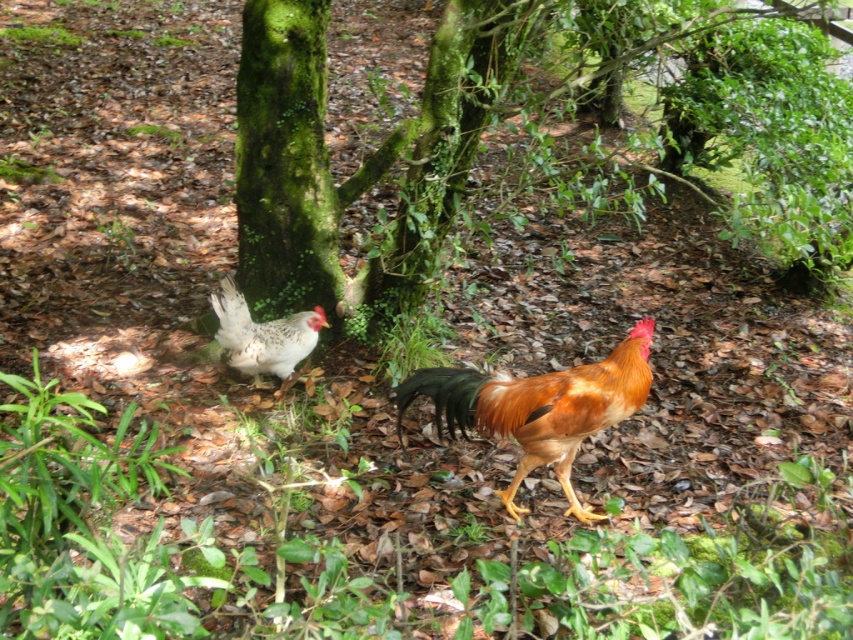
Which of these two, green mossy tree at center or speckled feathered chicken at center, stands taller?

With more height is green mossy tree at center.

Does green mossy tree at center have a smaller size compared to speckled feathered chicken at center?

Incorrect, green mossy tree at center is not smaller in size than speckled feathered chicken at center.

Measure the distance between green mossy tree at center and camera.

The distance of green mossy tree at center from camera is 3.05 meters.

Locate an element on the screen. This screenshot has width=853, height=640. green mossy tree at center is located at coordinates pos(505,113).

Is point (630, 390) positioned before point (233, 317)?

Yes, point (630, 390) is in front of point (233, 317).

Is golden brown feathered rooster at center above speckled feathered chicken at center?

No.

Who is more distant from viewer, (476, 381) or (270, 330)?

The point (270, 330) is more distant.

Identify the location of golden brown feathered rooster at center. The image size is (853, 640). (538, 406).

Between green mossy tree at center and golden brown feathered rooster at center, which one appears on the right side from the viewer's perspective?

Positioned to the right is green mossy tree at center.

Where is `green mossy tree at center`? The width and height of the screenshot is (853, 640). green mossy tree at center is located at coordinates (505, 113).